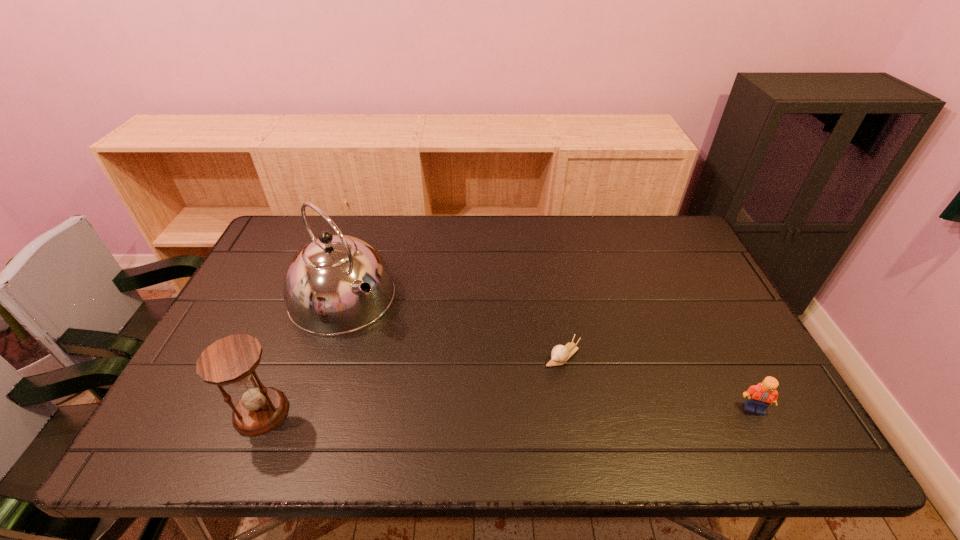
This screenshot has width=960, height=540. Find the location of `free area in between the Lego and the escargot`. free area in between the Lego and the escargot is located at coordinates (659, 382).

Find the location of `free space between the tallest object and the rightmost object`. free space between the tallest object and the rightmost object is located at coordinates (548, 352).

In order to click on blank region between the second tallest object and the tallest object in this screenshot , I will do `click(301, 354)`.

Locate an element on the screen. The width and height of the screenshot is (960, 540). empty location between the farthest object and the Lego is located at coordinates point(548,352).

You are a GUI agent. You are given a task and a screenshot of the screen. Output one action in this format:
    pyautogui.click(x=<x>, y=<y>)
    Task: Click on the unoccupied position between the second shortest object and the hourglass
    The width and height of the screenshot is (960, 540).
    Given the screenshot: What is the action you would take?
    pyautogui.click(x=508, y=410)

Locate an element on the screen. The image size is (960, 540). free point between the hourglass and the farthest object is located at coordinates (301, 354).

The image size is (960, 540). Identify the location of empty space that is in between the second tallest object and the tallest object. click(301, 354).

What are the coordinates of `the second closest object to the shortest object` in the screenshot? It's located at (337, 284).

Select which object appears as the second closest to the second tallest object. Please provide its 2D coordinates. Your answer should be formatted as a tuple, i.e. [(x, y)], where the tuple contains the x and y coordinates of a point satisfying the conditions above.

[(560, 354)]

Locate an element on the screen. vacant area that satisfies the following two spatial constraints: 1. on the front side of the farthest object; 2. on the right side of the escargot is located at coordinates (323, 355).